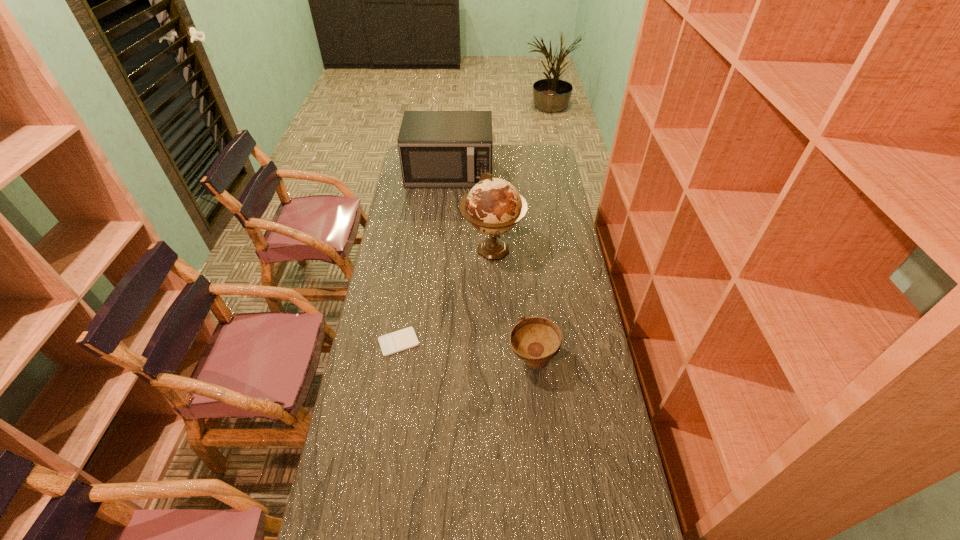
Where is `vacant space that satisfies the following two spatial constraints: 1. on the front-facing side of the microwave oven; 2. on the left side of the second shortest object`? This screenshot has width=960, height=540. vacant space that satisfies the following two spatial constraints: 1. on the front-facing side of the microwave oven; 2. on the left side of the second shortest object is located at coordinates (432, 360).

Where is `vacant space that satisfies the following two spatial constraints: 1. on the front side of the calculator; 2. on the left side of the soup bowl`? Image resolution: width=960 pixels, height=540 pixels. vacant space that satisfies the following two spatial constraints: 1. on the front side of the calculator; 2. on the left side of the soup bowl is located at coordinates (396, 360).